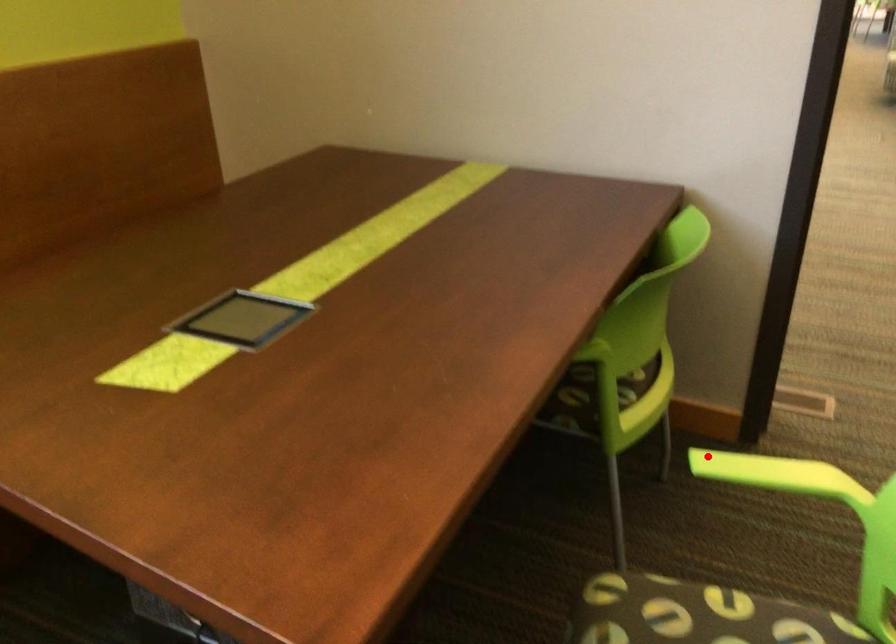
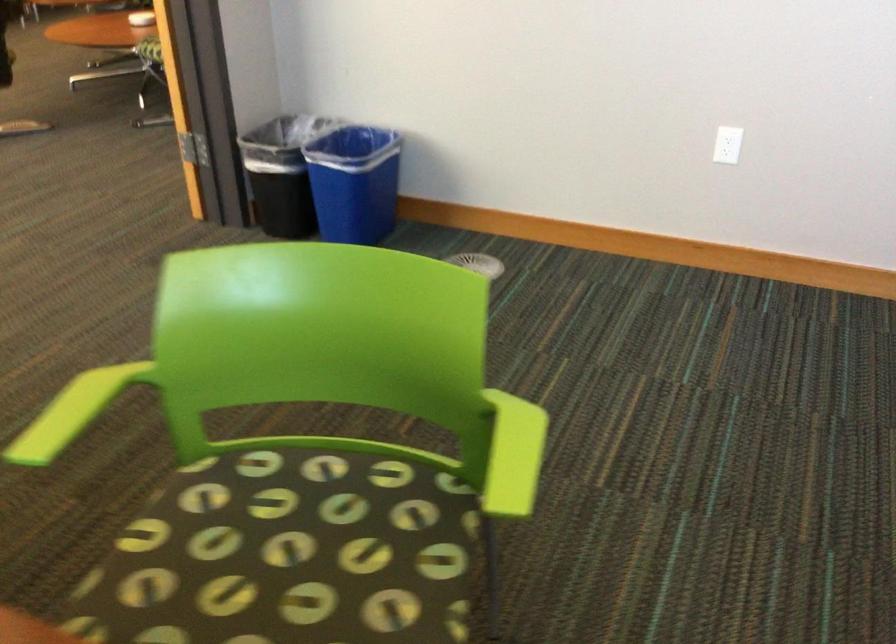
In the second image, find the point that corresponds to the highlighted location in the first image.

(55, 429)